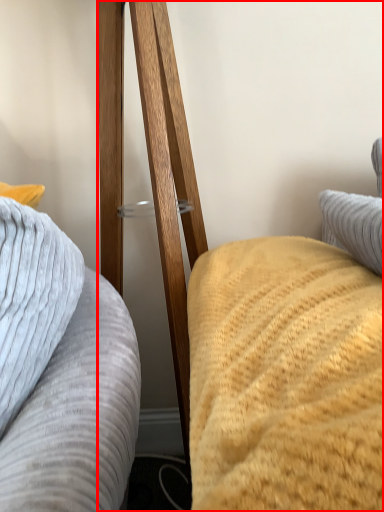
Question: In this image, where is furniture (annotated by the red box) located relative to furniture?

Choices:
 (A) left
 (B) right

Answer: (B)